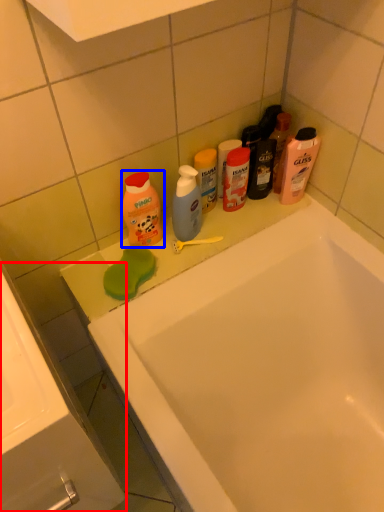
Question: Which object is further to the camera taking this photo, sink (highlighted by a red box) or cleaning product (highlighted by a blue box)?

Choices:
 (A) sink
 (B) cleaning product

Answer: (B)